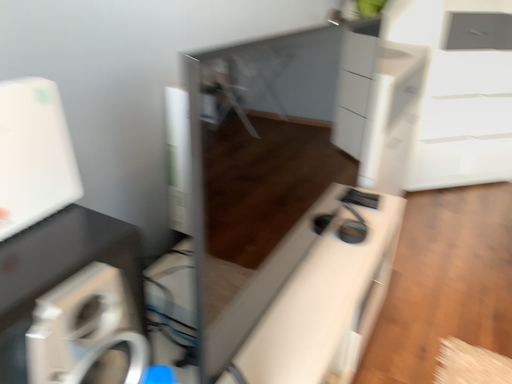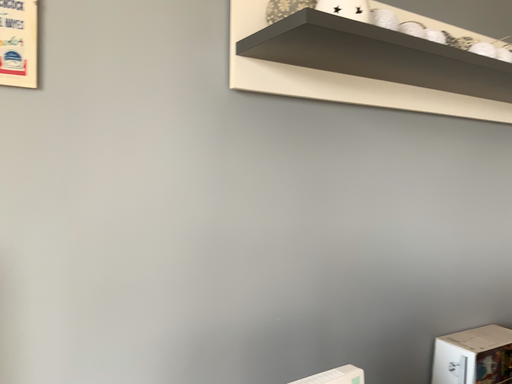
Question: Which way did the camera rotate in the video?

Choices:
 (A) rotated right
 (B) rotated left

Answer: (B)